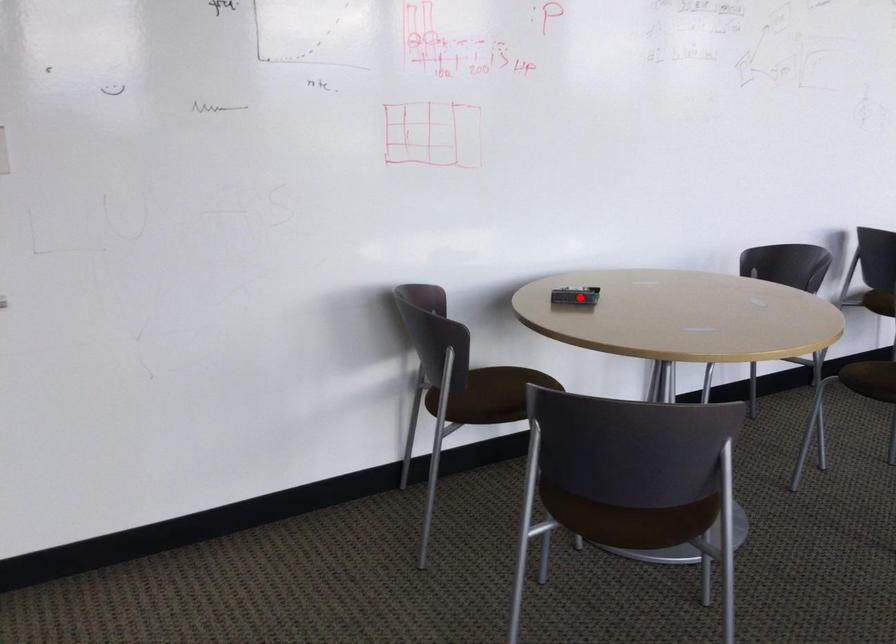
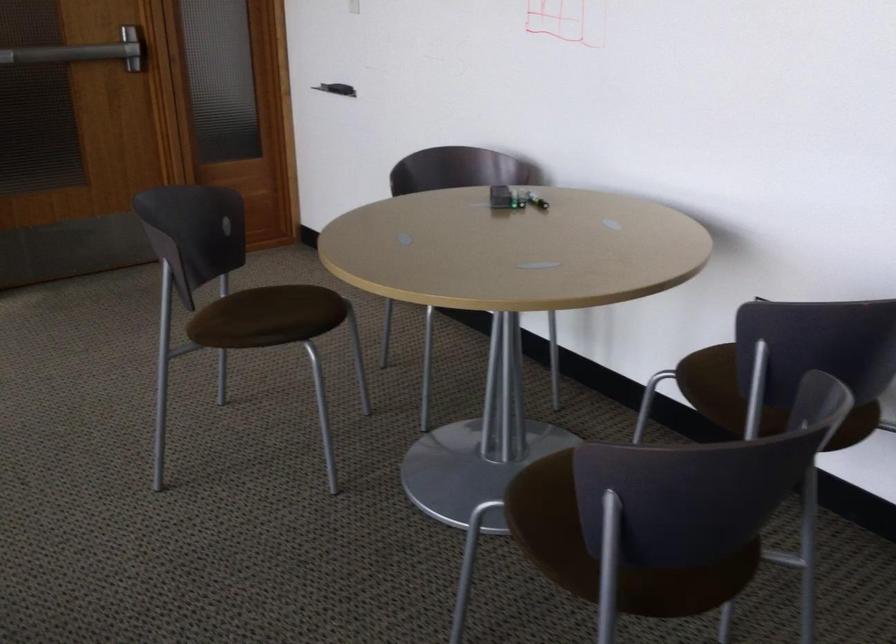
Locate, in the second image, the point that corresponds to the highlighted location in the first image.

(498, 198)